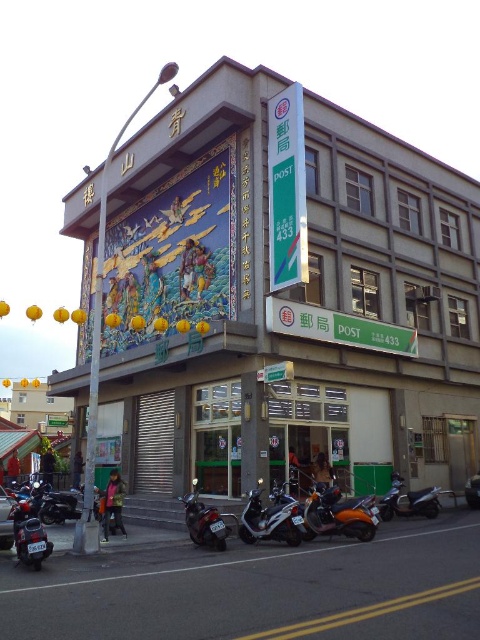
Who is lower down, matte gray building at center or shiny metallic motorcycle at lower right?

shiny metallic motorcycle at lower right is below.

Who is positioned more to the left, matte gray building at center or shiny metallic motorcycle at lower right?

matte gray building at center

Does point (178, 314) come behind point (432, 492)?

That is True.

In order to click on matte gray building at center in this screenshot , I will do `click(286, 301)`.

Who is shorter, metallic silver scooter at center or matte black motorcycle at lower left?

Standing shorter between the two is matte black motorcycle at lower left.

Between point (256, 496) and point (29, 541), which one is positioned behind?

The point (256, 496) is more distant.

This screenshot has height=640, width=480. I want to click on metallic silver scooter at center, so click(271, 518).

Looking at this image, is matte gray building at center bigger than matte black motorcycle at lower left?

Correct, matte gray building at center is larger in size than matte black motorcycle at lower left.

Between point (427, 464) and point (13, 518), which one is positioned behind?

Positioned behind is point (427, 464).

You are a GUI agent. You are given a task and a screenshot of the screen. Output one action in this format:
    pyautogui.click(x=<x>, y=<y>)
    Task: Click on the matte gray building at center
    This screenshot has height=640, width=480.
    Given the screenshot: What is the action you would take?
    pyautogui.click(x=286, y=301)